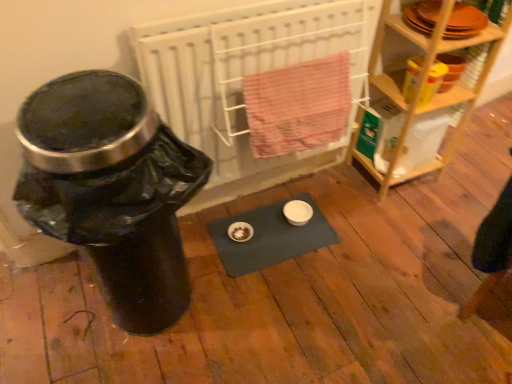
Where is `empty space that is to the right of blue fabric yoga mat at center`? This screenshot has height=384, width=512. empty space that is to the right of blue fabric yoga mat at center is located at coordinates (356, 235).